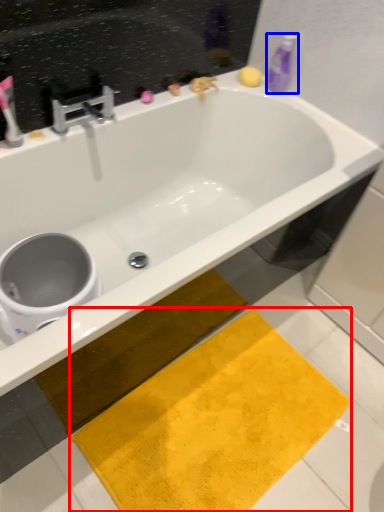
Question: Which object is further to the camera taking this photo, beach towel (highlighted by a red box) or cleaning product (highlighted by a blue box)?

Choices:
 (A) beach towel
 (B) cleaning product

Answer: (B)